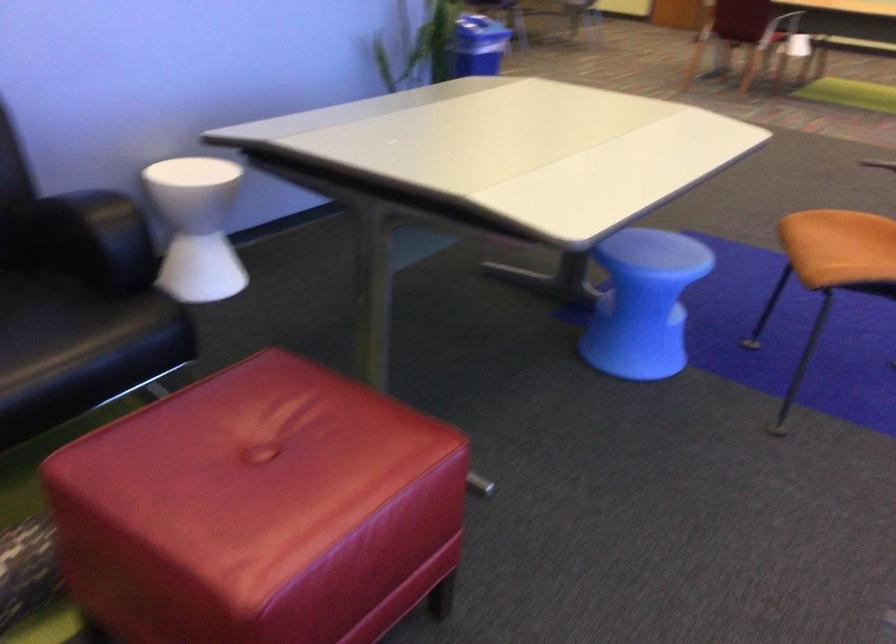
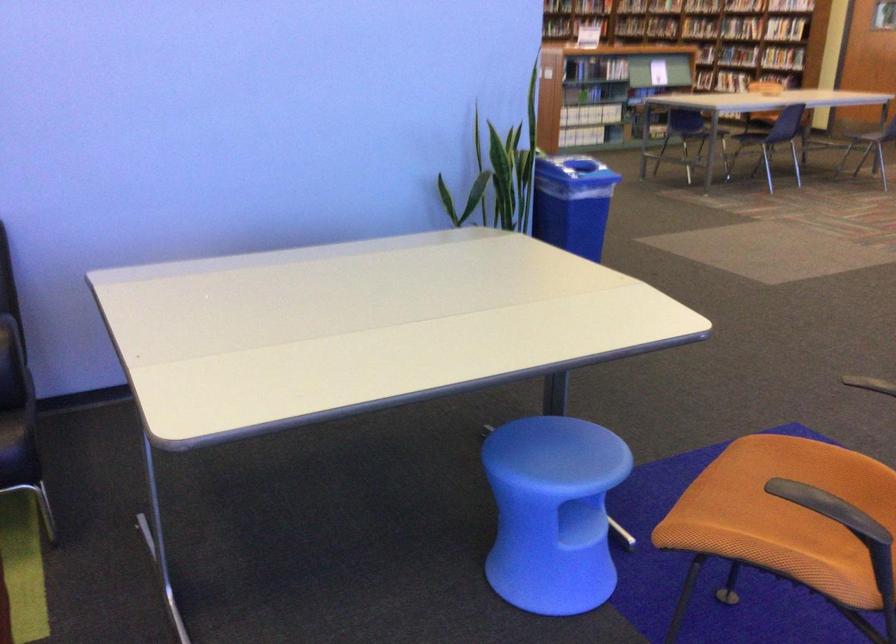
Locate, in the second image, the point that corresponds to point (657, 251) in the first image.

(560, 453)